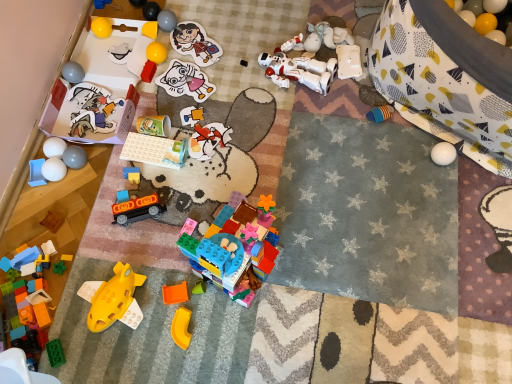
I want to click on free space that is to the left of yellow matte plastic arch at center, which is the 5th toy in right-to-left order, so click(126, 336).